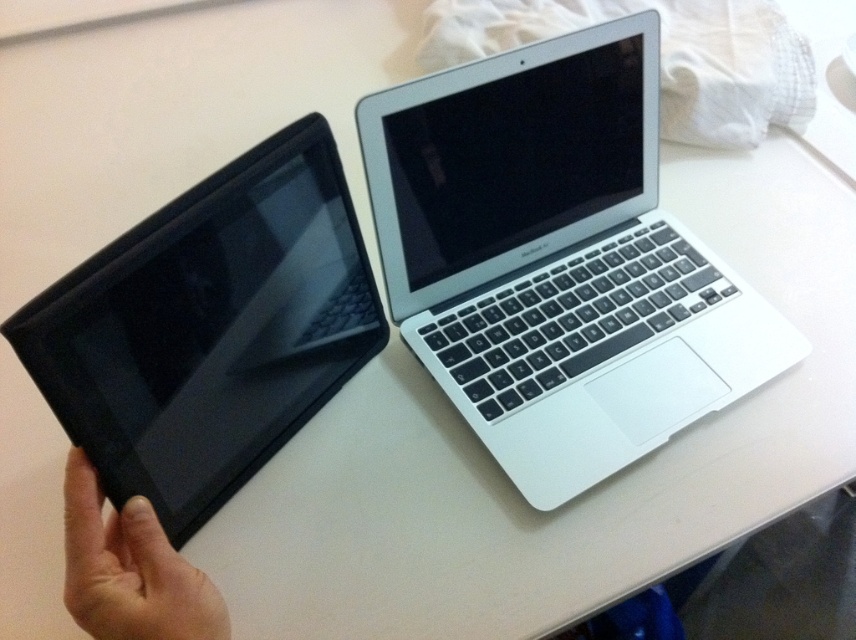
Question: Considering the real-world distances, which object is farthest from the skinny flesh-toned hand at lower left?

Choices:
 (A) silver metallic laptop at upper right
 (B) black matte tablet at left

Answer: (A)

Question: Is silver metallic laptop at upper right positioned at the back of skinny flesh-toned hand at lower left?

Choices:
 (A) no
 (B) yes

Answer: (B)

Question: Does silver metallic laptop at upper right have a larger size compared to black matte tablet at left?

Choices:
 (A) yes
 (B) no

Answer: (A)

Question: Which object appears closest to the camera in this image?

Choices:
 (A) skinny flesh-toned hand at lower left
 (B) silver metallic laptop at upper right
 (C) black matte tablet at left

Answer: (C)

Question: Based on their relative distances, which object is nearer to the skinny flesh-toned hand at lower left?

Choices:
 (A) black matte tablet at left
 (B) silver metallic laptop at upper right

Answer: (A)

Question: Does black matte tablet at left have a lesser width compared to skinny flesh-toned hand at lower left?

Choices:
 (A) yes
 (B) no

Answer: (B)